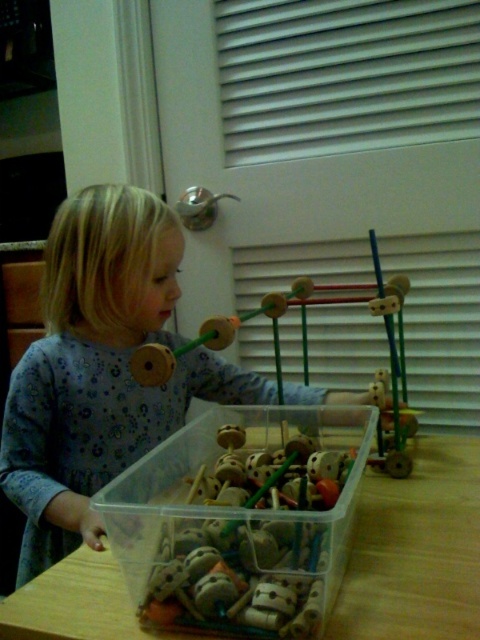
You are a parent trying to organize the play area. You need to place a new toy box on the right side of the wooden table at lower center. Is the blue fabric dress at center currently in the way of where you want to place the toy box?

The blue fabric dress at center is positioned on the left side of the wooden table at lower center, so it is not in the way of placing the toy box on the right side of the wooden table at lower center.

You are a parent trying to ensure your child can reach the wooden toy at center while sitting at the wooden table at lower center. Based on the height of the table and the toy, will the child need to stand to reach the toy?

The wooden table at lower center has a lesser height compared to wooden toy at center, so the child may need to stand to reach the wooden toy at center since the table is shorter than the toy.

In the scene described, there is a wooden table at lower center and wooden beads at center. Which object takes up more space in the image?

The wooden table at lower center takes up more space in the image because it is larger than the wooden beads at center.